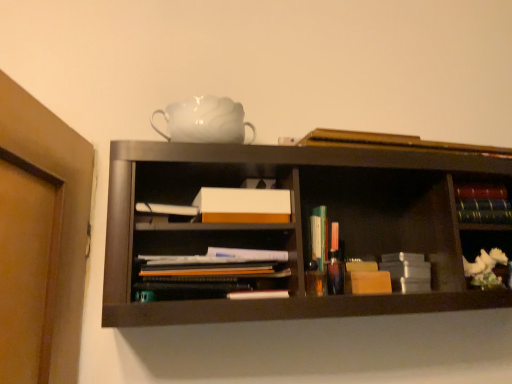
Question: Could you tell me if hardcover books at right, positioned as the 3th book in top-to-bottom order, is facing translucent plastic books at center, the first book in the bottom-to-top sequence?

Choices:
 (A) no
 (B) yes

Answer: (A)

Question: Is hardcover books at right, positioned as the 3th book in top-to-bottom order, shorter than translucent plastic books at center, which appears as the 4th book when viewed from the top?

Choices:
 (A) yes
 (B) no

Answer: (A)

Question: Can you confirm if hardcover books at right, positioned as the 3th book in top-to-bottom order, is positioned to the left of translucent plastic books at center, the first book in the bottom-to-top sequence?

Choices:
 (A) yes
 (B) no

Answer: (B)

Question: Is hardcover books at right, positioned as the 2th book in bottom-to-top order, at the right side of translucent plastic books at center, which appears as the 4th book when viewed from the top?

Choices:
 (A) no
 (B) yes

Answer: (B)

Question: From the image's perspective, is hardcover books at right, positioned as the 3th book in top-to-bottom order, located beneath translucent plastic books at center, which appears as the 4th book when viewed from the top?

Choices:
 (A) yes
 (B) no

Answer: (B)

Question: Is translucent plastic books at center, which appears as the 4th book when viewed from the top, a part of hardcover books at right, positioned as the 3th book in top-to-bottom order?

Choices:
 (A) yes
 (B) no

Answer: (B)

Question: Does matte paper documents at center come in front of white ceramic flower at right?

Choices:
 (A) yes
 (B) no

Answer: (A)

Question: From the image's perspective, is matte paper documents at center on white ceramic flower at right?

Choices:
 (A) no
 (B) yes

Answer: (B)

Question: From a real-world perspective, is matte paper documents at center physically above white ceramic flower at right?

Choices:
 (A) yes
 (B) no

Answer: (B)

Question: Is the surface of matte paper documents at center in direct contact with white ceramic flower at right?

Choices:
 (A) no
 (B) yes

Answer: (A)

Question: Does matte paper documents at center appear on the left side of white ceramic flower at right?

Choices:
 (A) yes
 (B) no

Answer: (A)

Question: Does matte paper documents at center have a smaller size compared to white ceramic flower at right?

Choices:
 (A) yes
 (B) no

Answer: (B)

Question: Is translucent plastic books at center, which appears as the 4th book when viewed from the top, facing towards white ceramic flower at right?

Choices:
 (A) no
 (B) yes

Answer: (A)